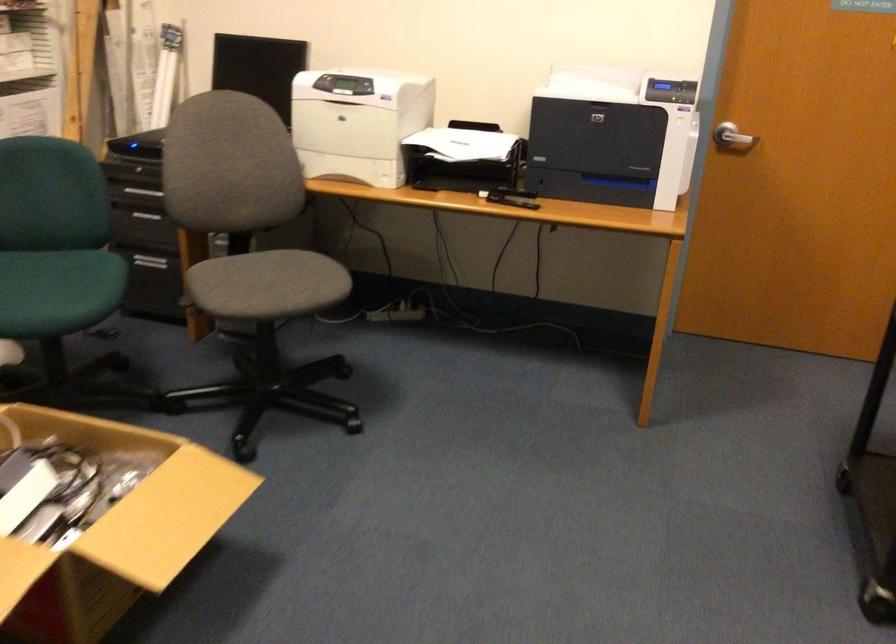
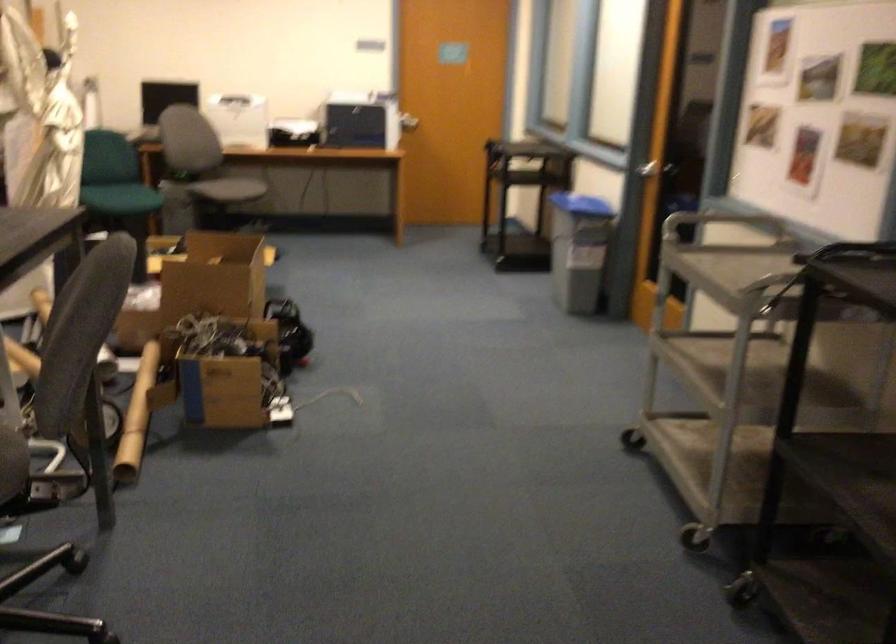
The point at (711, 158) is marked in the first image. Where is the corresponding point in the second image?

(409, 122)